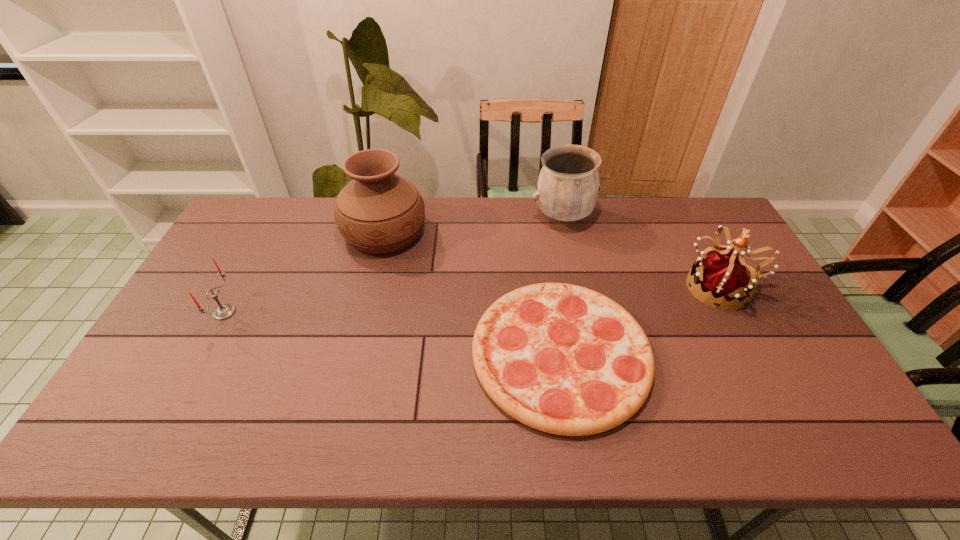
Where is `free space at the far right corner`? The width and height of the screenshot is (960, 540). free space at the far right corner is located at coordinates (691, 205).

Identify the location of vacant point located between the rightmost object and the shortest object. Image resolution: width=960 pixels, height=540 pixels. (640, 321).

Identify the location of free space between the pizza and the rightmost object. The image size is (960, 540). (640, 321).

I want to click on free space between the rightmost object and the left urn, so click(553, 260).

I want to click on empty location between the rightmost object and the candle, so click(x=472, y=300).

This screenshot has height=540, width=960. In order to click on empty space that is in between the leftmost object and the second object from left to right in this screenshot , I will do `click(304, 272)`.

Image resolution: width=960 pixels, height=540 pixels. I want to click on free space between the right urn and the leftmost object, so click(x=394, y=265).

Locate an element on the screen. free space between the second object from left to right and the right urn is located at coordinates (473, 225).

Locate an element on the screen. empty location between the left urn and the leftmost object is located at coordinates (304, 272).

The width and height of the screenshot is (960, 540). I want to click on vacant space that is in between the pizza and the fourth tallest object, so click(x=393, y=333).